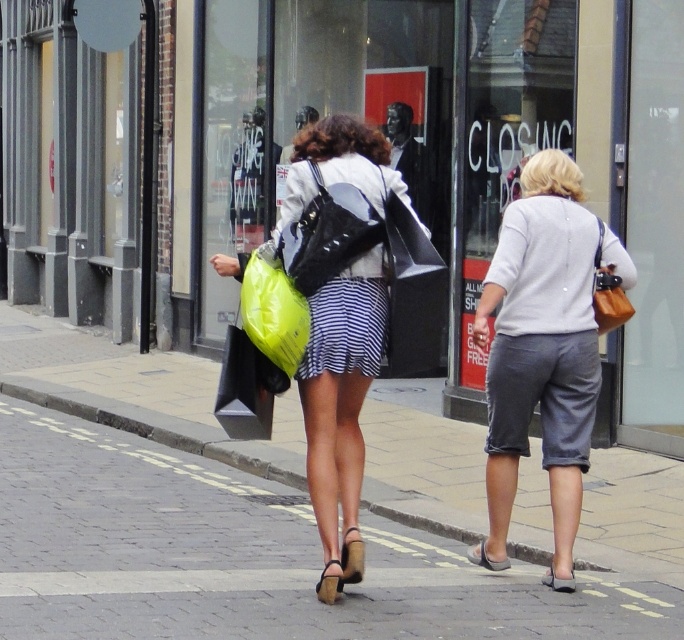
Does striped fabric skirt at center appear under matte black backpack at center?

Yes.

Between point (287, 202) and point (339, 228), which one is positioned in front?

Point (339, 228) is more forward.

Where is `striped fabric skirt at center`? The width and height of the screenshot is (684, 640). striped fabric skirt at center is located at coordinates (334, 467).

Image resolution: width=684 pixels, height=640 pixels. In order to click on striped fabric skirt at center in this screenshot , I will do `click(334, 467)`.

Can you confirm if brick pavement at center is positioned below brown leather handbag at right?

Correct, brick pavement at center is located below brown leather handbag at right.

Does point (157, 611) come farther from viewer compared to point (614, 268)?

That is False.

Which is behind, point (295, 588) or point (598, 282)?

The point (598, 282) is more distant.

I want to click on brick pavement at center, so click(x=244, y=556).

Is striped fabric skirt at center bigger than brown leather handbag at right?

Correct, striped fabric skirt at center is larger in size than brown leather handbag at right.

Does striped fabric skirt at center have a lesser width compared to brown leather handbag at right?

No.

Locate an element on the screen. This screenshot has width=684, height=640. striped fabric skirt at center is located at coordinates (334, 467).

The width and height of the screenshot is (684, 640). What are the coordinates of `striped fabric skirt at center` in the screenshot? It's located at (334, 467).